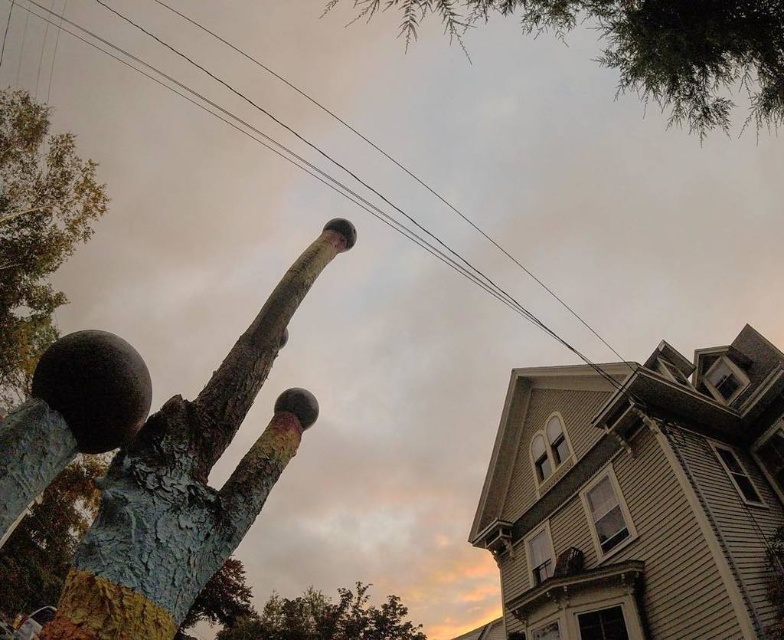
Question: Which point appears closest to the camera in this image?

Choices:
 (A) (95, 1)
 (B) (173, 509)
 (C) (5, 177)
 (D) (354, 618)

Answer: (B)

Question: Is rusty metal tree trunk at upper center to the left of green leafy tree at upper left from the viewer's perspective?

Choices:
 (A) no
 (B) yes

Answer: (A)

Question: Does green textured leaves at upper center come in front of black wire at upper center?

Choices:
 (A) yes
 (B) no

Answer: (A)

Question: Considering the real-world distances, which object is closest to the rusty metal tree trunk at upper center?

Choices:
 (A) green leafy tree at upper left
 (B) black wire at upper center
 (C) green leafy tree at lower center

Answer: (A)

Question: Which object is the closest to the green textured leaves at upper center?

Choices:
 (A) green leafy tree at lower center
 (B) rusty metal tree trunk at upper center
 (C) black wire at upper center

Answer: (C)

Question: Is green leafy tree at upper left positioned at the back of black wire at upper center?

Choices:
 (A) no
 (B) yes

Answer: (B)